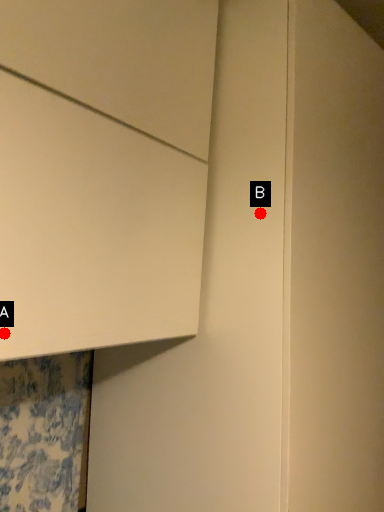
Question: Two points are circled on the image, labeled by A and B beside each circle. Among these points, which one is nearest to the camera?

Choices:
 (A) A is closer
 (B) B is closer

Answer: (A)